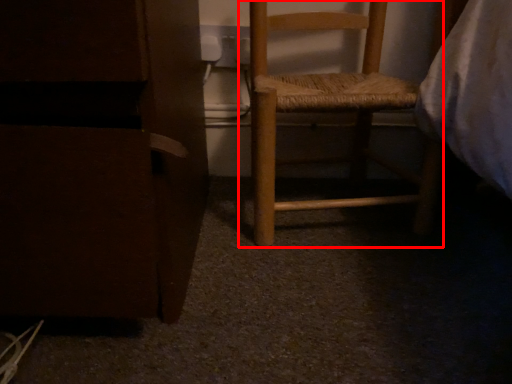
Question: From the image, what is the correct spatial relationship of furniture (annotated by the red box) in relation to furniture?

Choices:
 (A) right
 (B) left

Answer: (A)